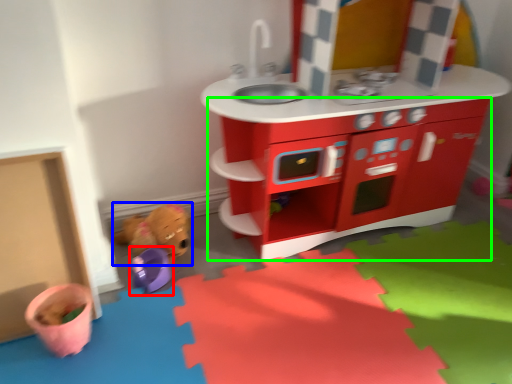
Question: Which object is the closest to the toy (highlighted by a red box)? Choose among these: toy (highlighted by a blue box) or cabinetry (highlighted by a green box).

Choices:
 (A) toy
 (B) cabinetry

Answer: (A)